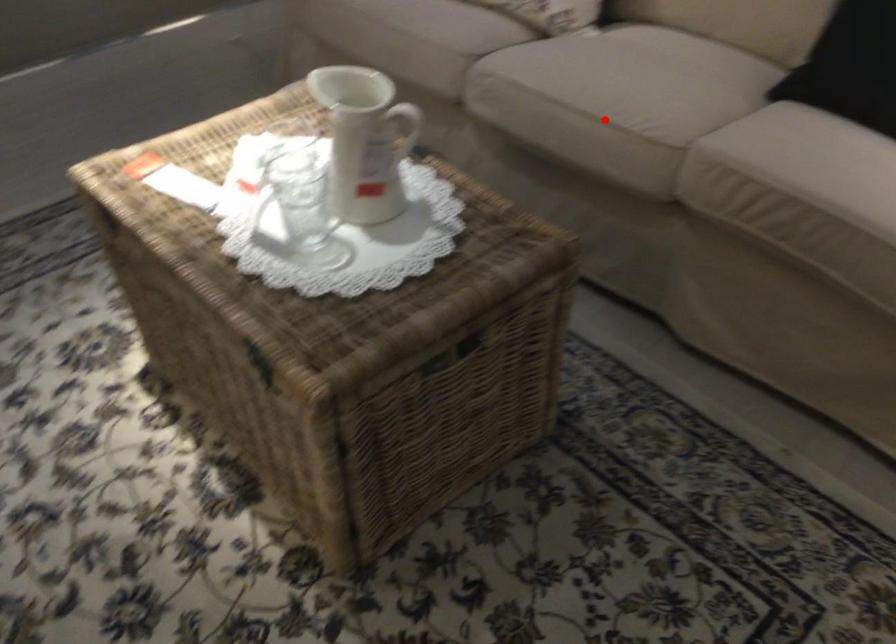
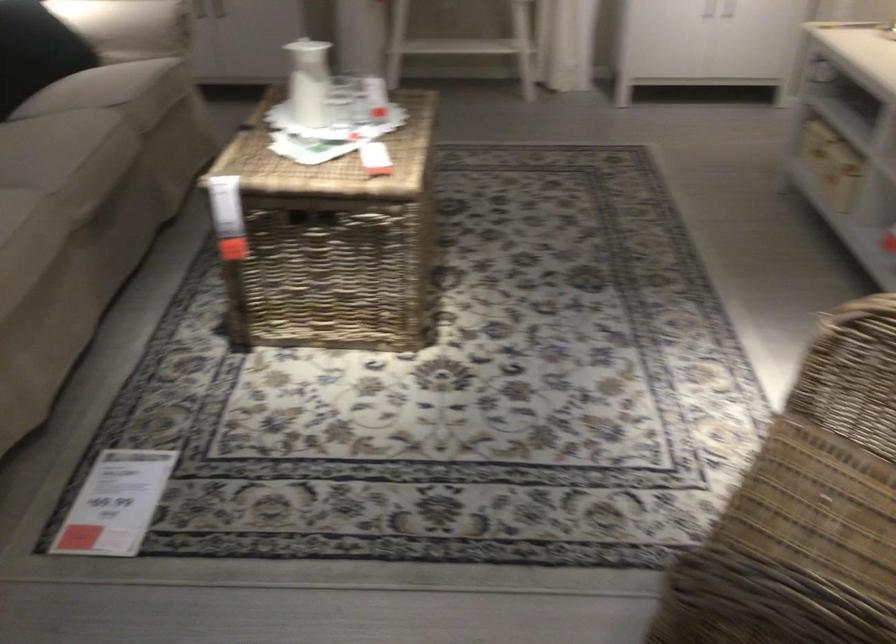
Find the pixel in the second image that matches the highlighted location in the first image.

(109, 140)